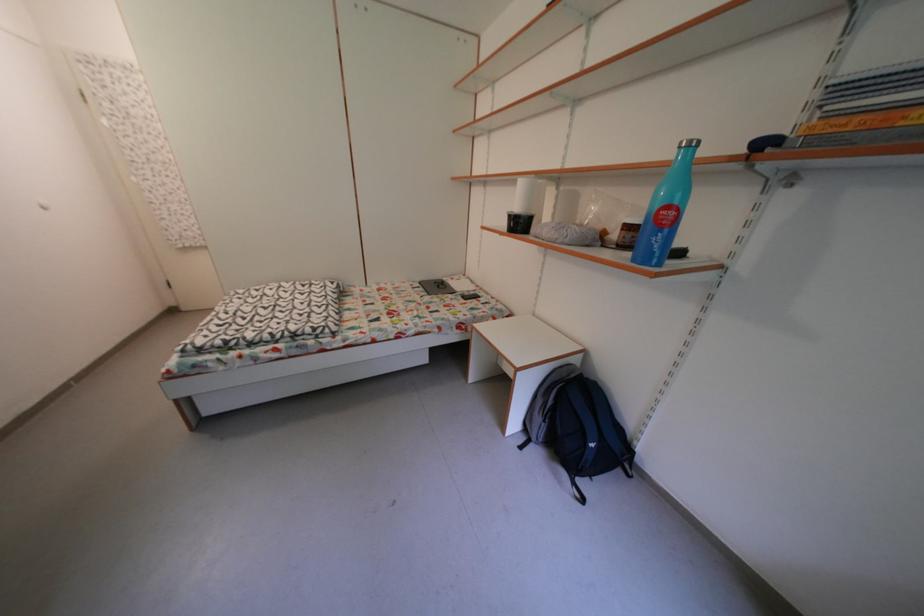
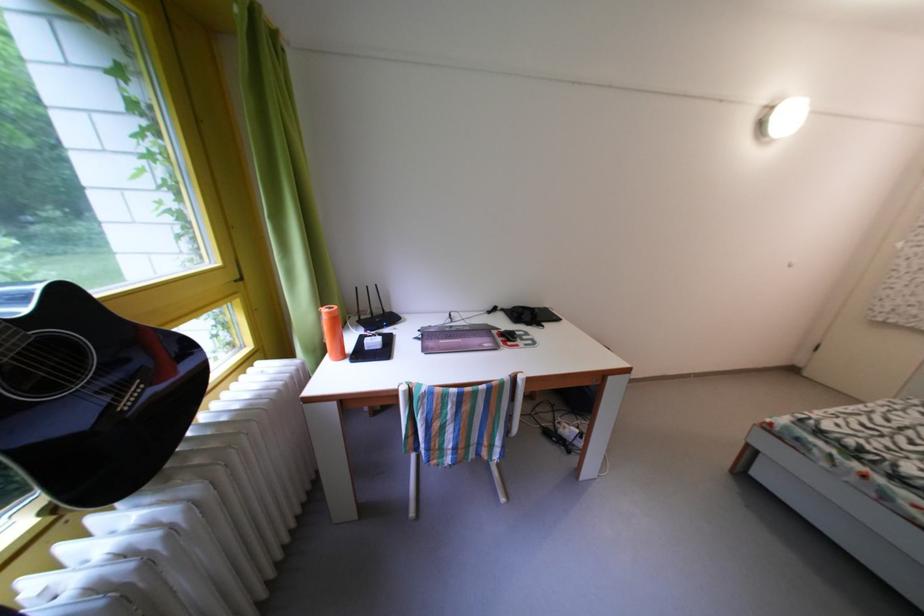
How did the camera likely rotate?

The camera rotated toward left-down.